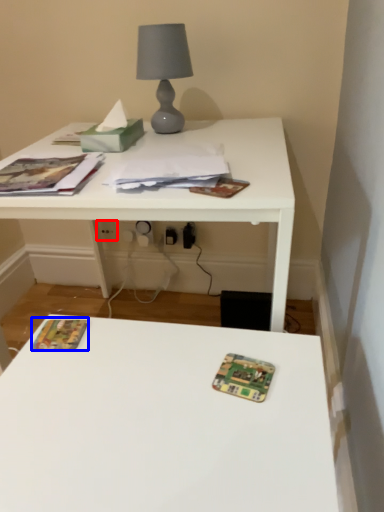
Question: Which object is further to the camera taking this photo, electric outlet (highlighted by a red box) or paperback book (highlighted by a blue box)?

Choices:
 (A) electric outlet
 (B) paperback book

Answer: (A)